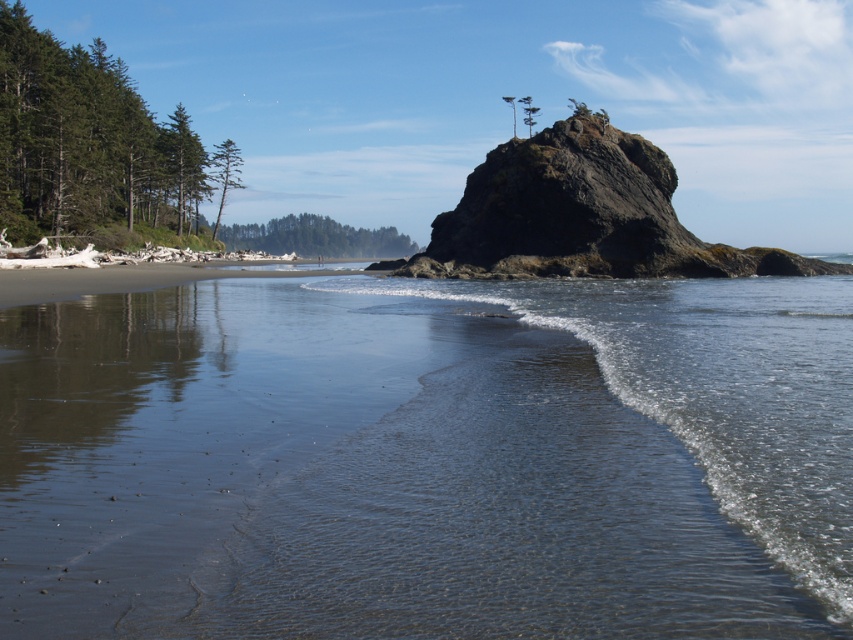
You are standing at the origin point of the coordinate system. You want to walk to the clear water at center. Which direction should you go?

The clear water at center is located at coordinate point (428,460), so you should move towards the positive x direction and stay at the same y level to reach it.

Based on the photo, you are standing on the sandy beach at lower left and want to reach the rough textured rock at center. Which direction should you move in?

The rough textured rock at center is to the right of the sandy beach at lower left, so you should move to the right to reach it.